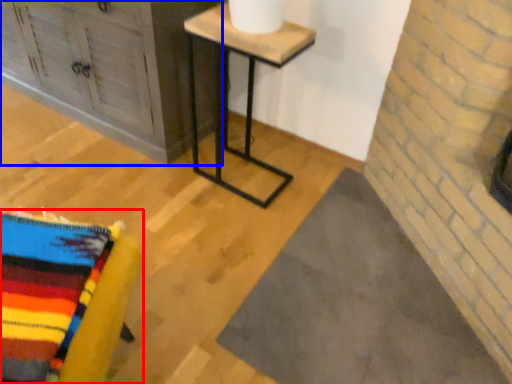
Question: Which of the following is the farthest to the observer, furniture (highlighted by a red box) or furniture (highlighted by a blue box)?

Choices:
 (A) furniture
 (B) furniture

Answer: (B)